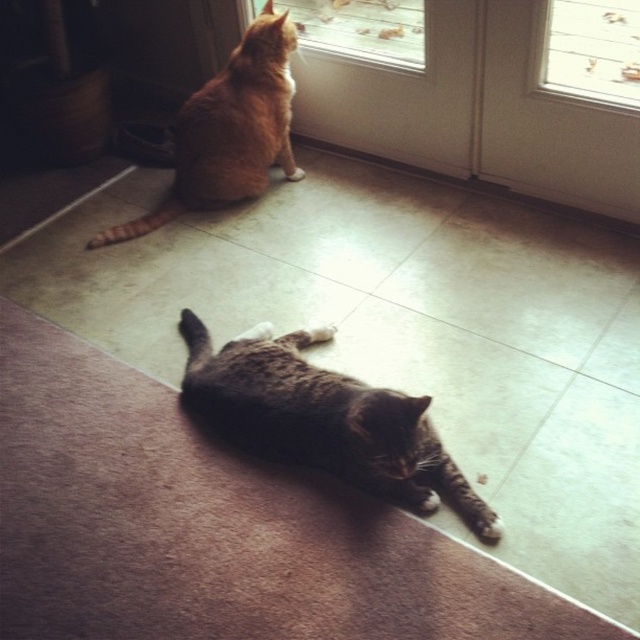
Question: Can you confirm if gray-furred cat at lower center is smaller than clear glass screen door at upper center?

Choices:
 (A) yes
 (B) no

Answer: (B)

Question: Which object is the closest to the orange fur cat at upper left?

Choices:
 (A) gray-furred cat at lower center
 (B) clear glass screen door at upper center
 (C) transparent glass screen door at upper center

Answer: (B)

Question: Which point is closer to the camera taking this photo?

Choices:
 (A) (241, 113)
 (B) (349, 86)
 (C) (576, 170)
 (D) (452, 464)

Answer: (D)

Question: Where is gray-furred cat at lower center located in relation to clear glass screen door at upper center in the image?

Choices:
 (A) below
 (B) above

Answer: (A)

Question: Can you confirm if transparent glass screen door at upper center is smaller than clear glass screen door at upper center?

Choices:
 (A) no
 (B) yes

Answer: (B)

Question: Which point is closer to the camera?

Choices:
 (A) orange fur cat at upper left
 (B) gray-furred cat at lower center
 (C) transparent glass screen door at upper center
 (D) clear glass screen door at upper center

Answer: (B)